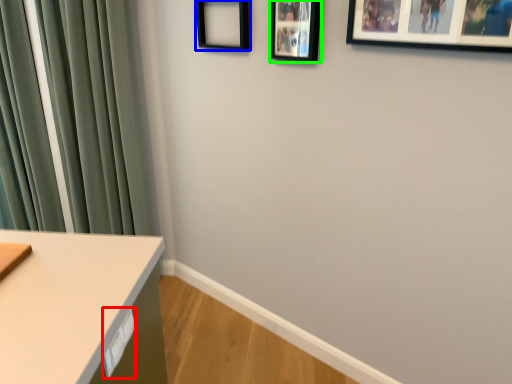
Question: Which object is positioned farthest from drawer (highlighted by a red box)? Select from picture frame (highlighted by a blue box) and picture frame (highlighted by a green box).

Choices:
 (A) picture frame
 (B) picture frame

Answer: (A)